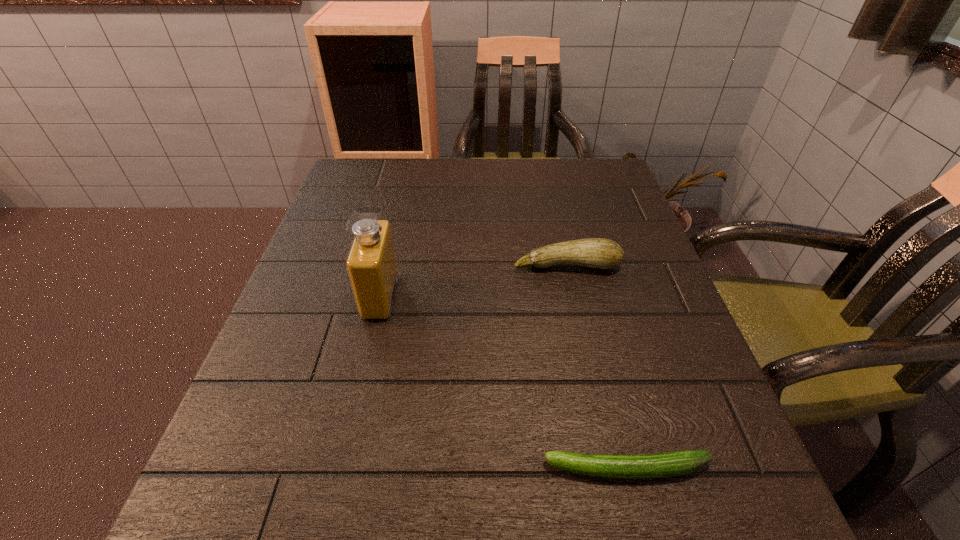
This screenshot has height=540, width=960. I want to click on perfume, so click(x=371, y=263).

I want to click on the leftmost object, so click(371, 263).

Find the location of `the taller zucchini`. the taller zucchini is located at coordinates (599, 253).

This screenshot has width=960, height=540. Identify the location of the farther zucchini. (599, 253).

Find the location of a particular element. the shortest object is located at coordinates (678, 463).

Identify the location of the shorter zucchini. click(x=678, y=463).

Where is `vacant space located on the front-facing side of the leftmost object`? vacant space located on the front-facing side of the leftmost object is located at coordinates (486, 296).

The image size is (960, 540). What are the coordinates of `vacant space located 0.260m at the stem end of the second shortest object` in the screenshot? It's located at (592, 382).

You are a GUI agent. You are given a task and a screenshot of the screen. Output one action in this format:
    pyautogui.click(x=<x>, y=<y>)
    Task: Click on the vacant space located 0.090m on the front-facing side of the nearer zucchini
    This screenshot has height=540, width=960.
    Given the screenshot: What is the action you would take?
    pyautogui.click(x=481, y=469)

Where is `free space located 0.320m on the front-facing side of the nearer zucchini`? The height and width of the screenshot is (540, 960). free space located 0.320m on the front-facing side of the nearer zucchini is located at coordinates (319, 469).